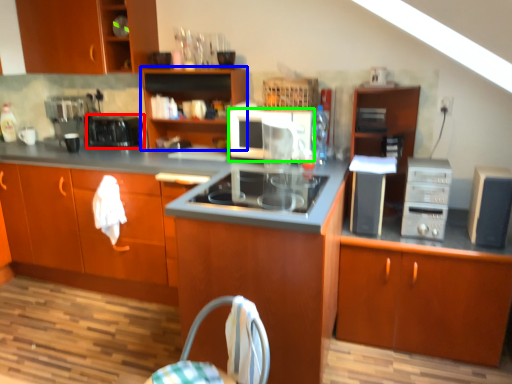
Question: Which object is positioned closest to kitchen appliance (highlighted by a red box)? Select from cabinetry (highlighted by a blue box) and kitchen appliance (highlighted by a green box).

Choices:
 (A) cabinetry
 (B) kitchen appliance

Answer: (A)